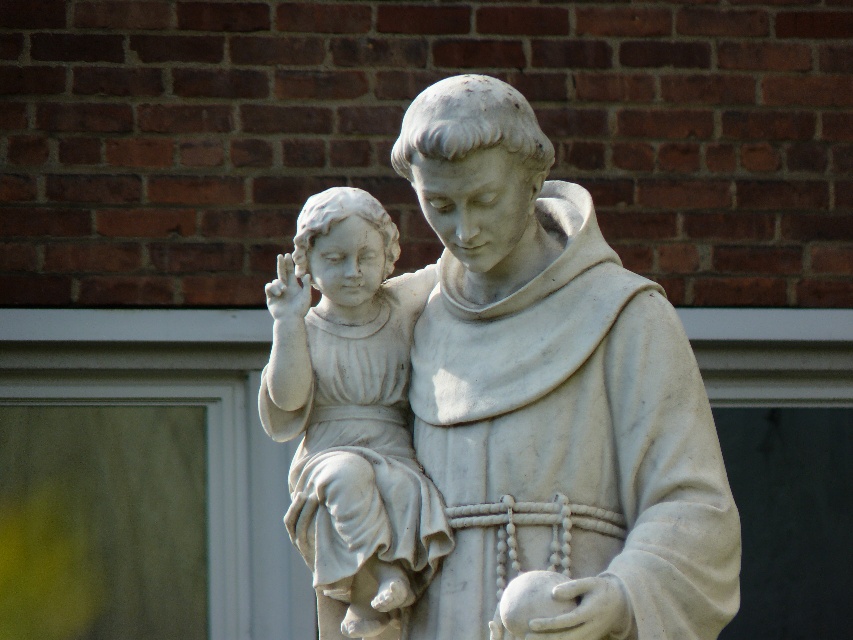
Question: Which point appears farthest from the camera in this image?

Choices:
 (A) (413, 356)
 (B) (408, 342)

Answer: (B)

Question: Can you confirm if white marble statue at center is bigger than white marble statue at left?

Choices:
 (A) no
 (B) yes

Answer: (B)

Question: Does white marble statue at center appear under white marble statue at left?

Choices:
 (A) yes
 (B) no

Answer: (A)

Question: Observing the image, what is the correct spatial positioning of white marble statue at center in reference to white marble statue at left?

Choices:
 (A) left
 (B) right

Answer: (B)